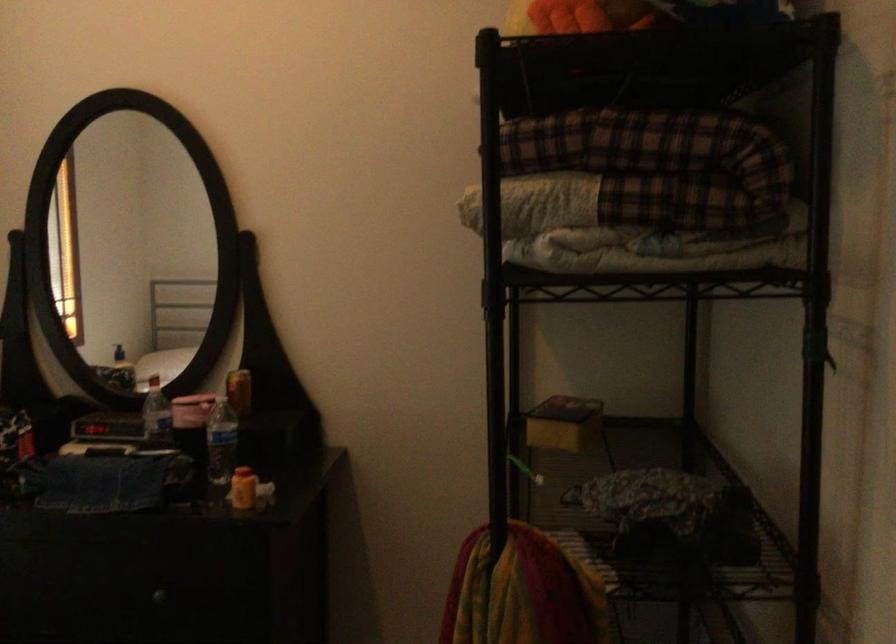
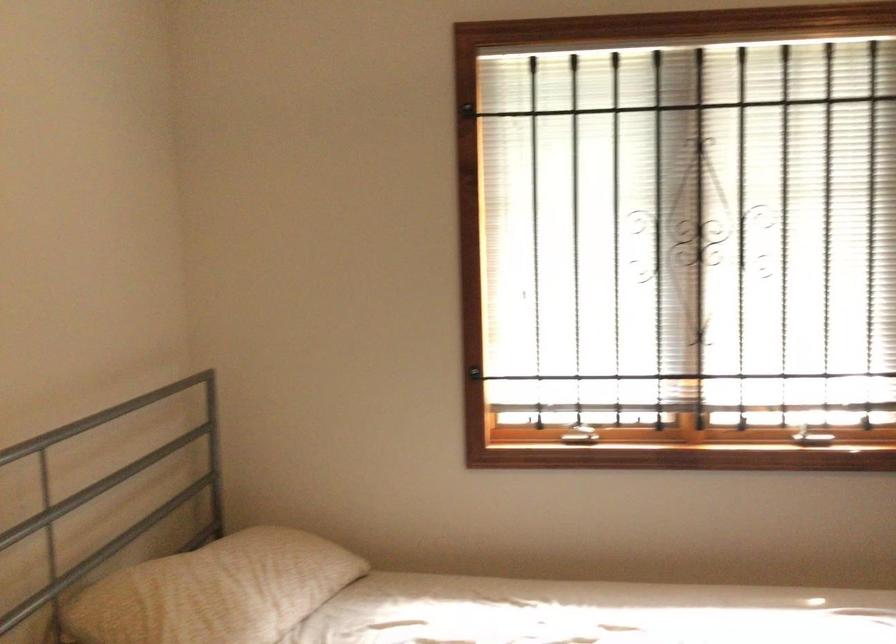
Question: Based on the continuous images, in which direction is the camera rotating? Reply with the corresponding letter.

Choices:
 (A) Left
 (B) Right
 (C) Up
 (D) Down

Answer: (A)